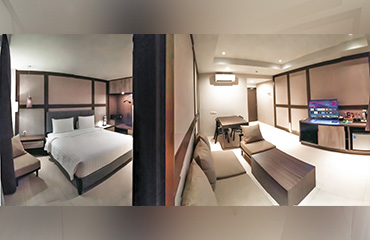
At what (x,y) coordinates should I click in order to perform the action: click on ac unit. Please return your answer as a coordinate pair (x, y). Looking at the image, I should click on (219, 76).